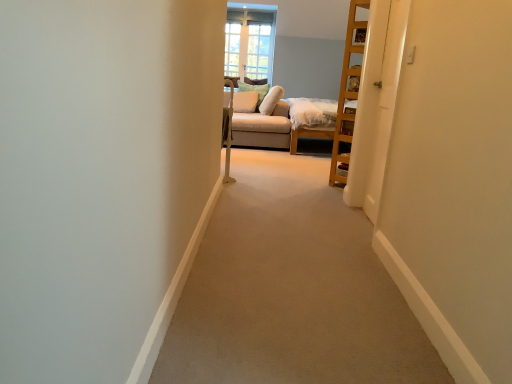
Locate an element on the screen. white soft pillow at upper center, the second pillow positioned from the right is located at coordinates (255, 89).

The width and height of the screenshot is (512, 384). I want to click on clear glass window at upper center, so click(249, 41).

The image size is (512, 384). I want to click on white fabric pillow at center, which is the third pillow from right to left, so click(x=245, y=102).

This screenshot has height=384, width=512. In order to click on white soft pillow at upper center, the second pillow positioned from the right in this screenshot , I will do `click(255, 89)`.

Is clear glass window at upper center aimed at white glossy door at right?

Yes, clear glass window at upper center is oriented towards white glossy door at right.

Where is `window that appears above the white glossy door at right (from a real-world perspective)`? The width and height of the screenshot is (512, 384). window that appears above the white glossy door at right (from a real-world perspective) is located at coordinates 249,41.

Considering the sizes of objects clear glass window at upper center and white glossy door at right in the image provided, who is bigger, clear glass window at upper center or white glossy door at right?

clear glass window at upper center is bigger.

Is clear glass window at upper center directly adjacent to white glossy door at right?

They are not placed beside each other.

Is white soft pillow at upper center, arranged as the 2th pillow when viewed from the left, situated inside suede beige couch at center or outside?

white soft pillow at upper center, arranged as the 2th pillow when viewed from the left, is contained in suede beige couch at center.

Looking at their sizes, would you say white soft pillow at upper center, arranged as the 2th pillow when viewed from the left, is wider or thinner than suede beige couch at center?

Clearly, white soft pillow at upper center, arranged as the 2th pillow when viewed from the left, has less width compared to suede beige couch at center.

Does white soft pillow at upper center, the second pillow positioned from the right, appear on the left side of suede beige couch at center?

Yes.

In the image, is white soft pillow at upper center, arranged as the 2th pillow when viewed from the left, positioned in front of or behind suede beige couch at center?

Visually, white soft pillow at upper center, arranged as the 2th pillow when viewed from the left, is located behind suede beige couch at center.

From the image's perspective, is white glossy door at right located above or below white soft pillow at upper center, the second pillow positioned from the right?

Clearly, from the image's perspective, white glossy door at right is below white soft pillow at upper center, the second pillow positioned from the right.

Based on their positions, is white glossy door at right located to the left or right of white soft pillow at upper center, arranged as the 2th pillow when viewed from the left?

In the image, white glossy door at right appears on the right side of white soft pillow at upper center, arranged as the 2th pillow when viewed from the left.

Find the location of a particular element. The image size is (512, 384). door that appears on the right of white soft pillow at upper center, arranged as the 2th pillow when viewed from the left is located at coordinates (386, 104).

Does white glossy door at right come behind white soft pillow at upper center, arranged as the 2th pillow when viewed from the left?

No, white glossy door at right is in front of white soft pillow at upper center, arranged as the 2th pillow when viewed from the left.

Would you consider suede beige couch at center to be distant from white fabric pillow at center, which is the third pillow from right to left?

No, suede beige couch at center is not far away from white fabric pillow at center, which is the third pillow from right to left.

What's the angular difference between suede beige couch at center and white fabric pillow at center, the first pillow positioned from the left,'s facing directions?

78.1 degrees.

Measure the distance between suede beige couch at center and white fabric pillow at center, which is the third pillow from right to left.

They are 20.27 inches apart.

At what (x,y) coordinates should I click in order to perform the action: click on couch directly beneath the white fabric pillow at center, which is the third pillow from right to left (from a real-world perspective). Please return your answer as a coordinate pair (x, y). Image resolution: width=512 pixels, height=384 pixels. Looking at the image, I should click on (262, 122).

Is soft white pillow at center, the 3th pillow when ordered from left to right, taller than suede beige couch at center?

No.

Consider the image. How much distance is there between soft white pillow at center, which is the 1th pillow in right-to-left order, and suede beige couch at center?

They are 9.67 inches apart.

Looking at this image, which is more distant, (272, 112) or (289, 134)?

The point (272, 112) is behind.

Who is bigger, soft white pillow at center, the 3th pillow when ordered from left to right, or suede beige couch at center?

With larger size is suede beige couch at center.

Considering the sizes of objects suede beige couch at center and clear glass window at upper center in the image provided, who is bigger, suede beige couch at center or clear glass window at upper center?

suede beige couch at center.

Is suede beige couch at center facing away from clear glass window at upper center?

suede beige couch at center is not turned away from clear glass window at upper center.

At what (x,y) coordinates should I click in order to perform the action: click on couch that is below the clear glass window at upper center (from the image's perspective). Please return your answer as a coordinate pair (x, y). Looking at the image, I should click on (262, 122).

Who is taller, suede beige couch at center or clear glass window at upper center?

With more height is clear glass window at upper center.

From the image's perspective, does white fabric pillow at center, which is the third pillow from right to left, appear lower than suede beige couch at center?

No, from the image's perspective, white fabric pillow at center, which is the third pillow from right to left, is not beneath suede beige couch at center.

Is white fabric pillow at center, the first pillow positioned from the left, oriented towards suede beige couch at center?

Yes, white fabric pillow at center, the first pillow positioned from the left, is oriented towards suede beige couch at center.

Can we say white fabric pillow at center, the first pillow positioned from the left, lies outside suede beige couch at center?

No, most part of white fabric pillow at center, the first pillow positioned from the left, lies within suede beige couch at center.

Find the location of a particular element. door on the right of the clear glass window at upper center is located at coordinates (386, 104).

Where is `couch below the white soft pillow at upper center, arranged as the 2th pillow when viewed from the left (from the image's perspective)`? couch below the white soft pillow at upper center, arranged as the 2th pillow when viewed from the left (from the image's perspective) is located at coordinates (262, 122).

Considering their positions, is clear glass window at upper center positioned further to white soft pillow at upper center, the second pillow positioned from the right, than white fabric pillow at center, which is the third pillow from right to left?

The object further to white soft pillow at upper center, the second pillow positioned from the right, is clear glass window at upper center.

Looking at the image, which one is located further to clear glass window at upper center, white glossy door at right or soft white pillow at center, which is the 1th pillow in right-to-left order?

The object further to clear glass window at upper center is white glossy door at right.

Considering their positions, is clear glass window at upper center positioned closer to soft white pillow at center, the 3th pillow when ordered from left to right, than white fabric pillow at center, which is the third pillow from right to left?

white fabric pillow at center, which is the third pillow from right to left, is closer to soft white pillow at center, the 3th pillow when ordered from left to right.

Based on their spatial positions, is clear glass window at upper center or soft white pillow at center, the 3th pillow when ordered from left to right, further from white fabric pillow at center, the first pillow positioned from the left?

Based on the image, clear glass window at upper center appears to be further to white fabric pillow at center, the first pillow positioned from the left.

Estimate the real-world distances between objects in this image. Which object is closer to soft white pillow at center, the 3th pillow when ordered from left to right, white soft pillow at upper center, arranged as the 2th pillow when viewed from the left, or clear glass window at upper center?

white soft pillow at upper center, arranged as the 2th pillow when viewed from the left, is closer to soft white pillow at center, the 3th pillow when ordered from left to right.

Based on their spatial positions, is clear glass window at upper center or white glossy door at right further from white soft pillow at upper center, the second pillow positioned from the right?

white glossy door at right lies further to white soft pillow at upper center, the second pillow positioned from the right, than the other object.

Considering their positions, is soft white pillow at center, the 3th pillow when ordered from left to right, positioned closer to white fabric pillow at center, which is the third pillow from right to left, than suede beige couch at center?

soft white pillow at center, the 3th pillow when ordered from left to right, is closer to white fabric pillow at center, which is the third pillow from right to left.

Estimate the real-world distances between objects in this image. Which object is further from clear glass window at upper center, white fabric pillow at center, the first pillow positioned from the left, or white soft pillow at upper center, the second pillow positioned from the right?

The object further to clear glass window at upper center is white fabric pillow at center, the first pillow positioned from the left.

Image resolution: width=512 pixels, height=384 pixels. Find the location of `pillow between soft white pillow at center, the 3th pillow when ordered from left to right, and white soft pillow at upper center, arranged as the 2th pillow when viewed from the left, along the z-axis`. pillow between soft white pillow at center, the 3th pillow when ordered from left to right, and white soft pillow at upper center, arranged as the 2th pillow when viewed from the left, along the z-axis is located at coordinates (245, 102).

The height and width of the screenshot is (384, 512). Find the location of `couch located between white glossy door at right and white fabric pillow at center, the first pillow positioned from the left, in the depth direction`. couch located between white glossy door at right and white fabric pillow at center, the first pillow positioned from the left, in the depth direction is located at coordinates (262, 122).

Locate an element on the screen. couch positioned between white glossy door at right and soft white pillow at center, the 3th pillow when ordered from left to right, from near to far is located at coordinates (262, 122).

Identify the location of pillow between white fabric pillow at center, which is the third pillow from right to left, and clear glass window at upper center in the front-back direction. This screenshot has width=512, height=384. (255, 89).